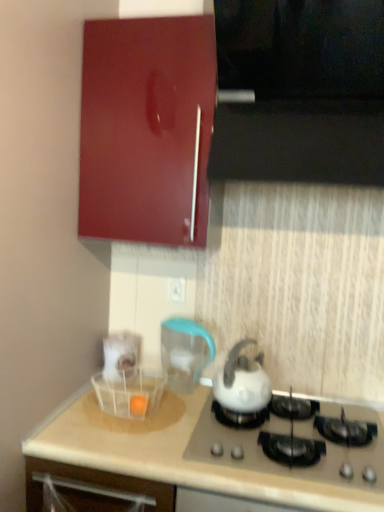
Question: Is white glossy kettle at center bigger than glossy wood cabinet at upper left?

Choices:
 (A) no
 (B) yes

Answer: (A)

Question: Is white glossy kettle at center closer to the viewer compared to glossy wood cabinet at upper left?

Choices:
 (A) yes
 (B) no

Answer: (B)

Question: Is white glossy kettle at center not near glossy wood cabinet at upper left?

Choices:
 (A) yes
 (B) no

Answer: (B)

Question: Does white glossy kettle at center appear on the left side of glossy wood cabinet at upper left?

Choices:
 (A) yes
 (B) no

Answer: (B)

Question: Could you tell me if white glossy kettle at center is facing glossy wood cabinet at upper left?

Choices:
 (A) no
 (B) yes

Answer: (A)

Question: From the image's perspective, is white glossy kettle at center above glossy wood cabinet at upper left?

Choices:
 (A) yes
 (B) no

Answer: (B)

Question: Does white plastic drawer at lower left have a greater width compared to white plastic electric outlet at center?

Choices:
 (A) no
 (B) yes

Answer: (B)

Question: From the image's perspective, is white plastic drawer at lower left located beneath white plastic electric outlet at center?

Choices:
 (A) no
 (B) yes

Answer: (B)

Question: Considering the relative sizes of white plastic drawer at lower left and white plastic electric outlet at center in the image provided, is white plastic drawer at lower left thinner than white plastic electric outlet at center?

Choices:
 (A) no
 (B) yes

Answer: (A)

Question: Is white plastic drawer at lower left turned away from white plastic electric outlet at center?

Choices:
 (A) yes
 (B) no

Answer: (B)

Question: Does white plastic drawer at lower left touch white plastic electric outlet at center?

Choices:
 (A) no
 (B) yes

Answer: (A)

Question: Can you confirm if white plastic drawer at lower left is taller than white plastic electric outlet at center?

Choices:
 (A) yes
 (B) no

Answer: (A)

Question: Does glossy wood cabinet at upper left have a smaller size compared to white plastic drawer at lower left?

Choices:
 (A) yes
 (B) no

Answer: (B)